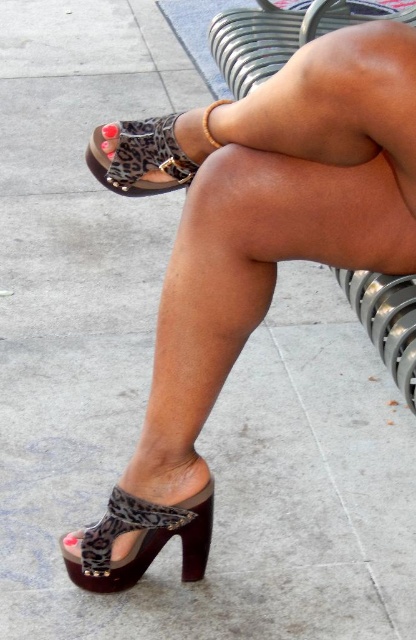
You are trying to choose between two leopard print sandals in the image. The leopard print sandal at lower center and the leopard print fabric sandal at lower left. Which one has a wider base?

The leopard print sandal at lower center might be wider than leopard print fabric sandal at lower left according to the description.

You are standing in front of the bench and want to place a small object exactly at the location of the point marked as point (x=151, y=152). According to the scene, what object will the small object be placed on?

The small object will be placed on the leopard print sandal at lower center located at point (x=151, y=152).